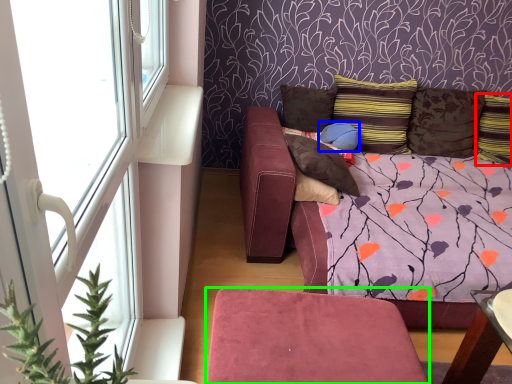
Question: Based on their relative distances, which object is farther from pillow (highlighted by a red box)? Choose from pillow (highlighted by a blue box) and furniture (highlighted by a green box).

Choices:
 (A) pillow
 (B) furniture

Answer: (B)